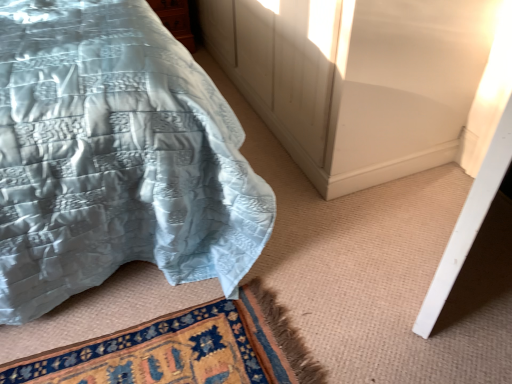
Question: From the image's perspective, is wooden cabinet at upper left positioned above or below silky blue quilt at upper left?

Choices:
 (A) below
 (B) above

Answer: (B)

Question: Is wooden cabinet at upper left bigger or smaller than silky blue quilt at upper left?

Choices:
 (A) small
 (B) big

Answer: (A)

Question: In terms of width, does wooden cabinet at upper left look wider or thinner when compared to silky blue quilt at upper left?

Choices:
 (A) thin
 (B) wide

Answer: (A)

Question: Relative to wooden cabinet at upper left, is silky blue quilt at upper left in front or behind?

Choices:
 (A) front
 (B) behind

Answer: (A)

Question: Based on their positions, is silky blue quilt at upper left located to the left or right of wooden cabinet at upper left?

Choices:
 (A) left
 (B) right

Answer: (A)

Question: In terms of width, does silky blue quilt at upper left look wider or thinner when compared to wooden cabinet at upper left?

Choices:
 (A) thin
 (B) wide

Answer: (B)

Question: Which is correct: silky blue quilt at upper left is inside wooden cabinet at upper left, or outside of it?

Choices:
 (A) outside
 (B) inside

Answer: (A)